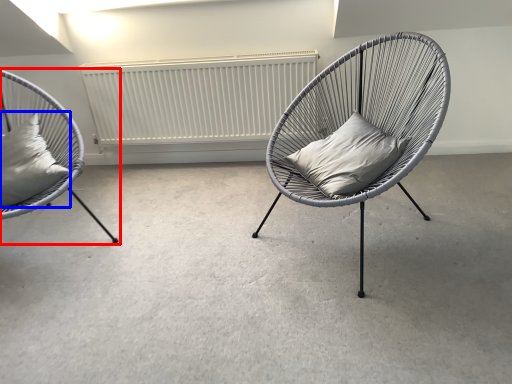
Question: Which object appears closest to the camera in this image, chair (highlighted by a red box) or pillow (highlighted by a blue box)?

Choices:
 (A) chair
 (B) pillow

Answer: (A)